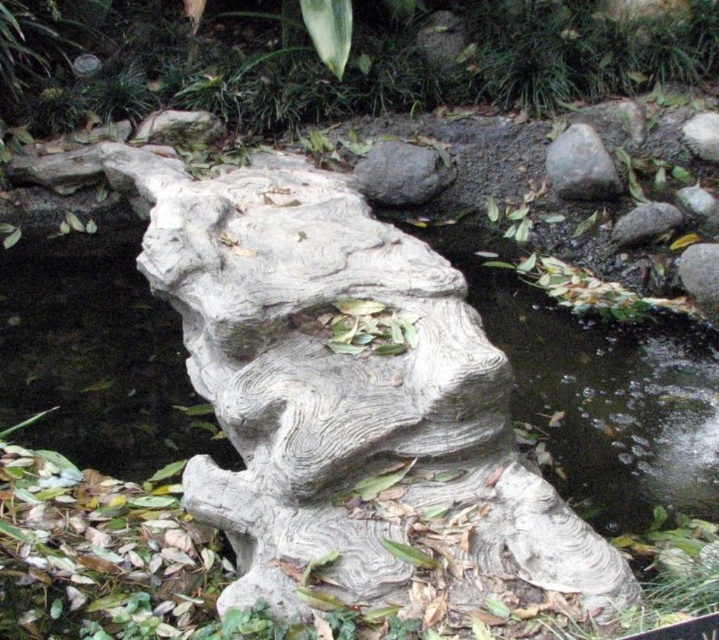
Question: Does gray wood log at center have a greater width compared to gray rough stone at lower right?

Choices:
 (A) no
 (B) yes

Answer: (A)

Question: Is gray rough rock at upper right wider than gray wood log at center?

Choices:
 (A) yes
 (B) no

Answer: (A)

Question: Among these objects, which one is nearest to the camera?

Choices:
 (A) white textured rock at upper right
 (B) gray wood sculpture at center

Answer: (B)

Question: Considering the real-world distances, which object is closest to the gray wood log at center?

Choices:
 (A) white textured rock at upper right
 (B) gray rough rock at upper right
 (C) gray rough stone at lower right
 (D) gray rough rock at upper center

Answer: (C)

Question: Observing the image, what is the correct spatial positioning of gray rough rock at upper right in reference to gray wood log at center?

Choices:
 (A) below
 (B) above

Answer: (B)

Question: Which object is the closest to the gray rough rock at upper center?

Choices:
 (A) gray wood log at center
 (B) gray wood sculpture at center
 (C) gray rough stone at lower right
 (D) gray rough rock at upper right

Answer: (D)